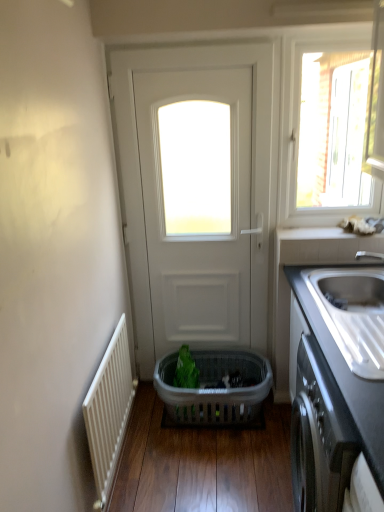
The height and width of the screenshot is (512, 384). In order to click on free space above black matte cabinet at lower right (from a real-world perspective) in this screenshot , I will do `click(356, 353)`.